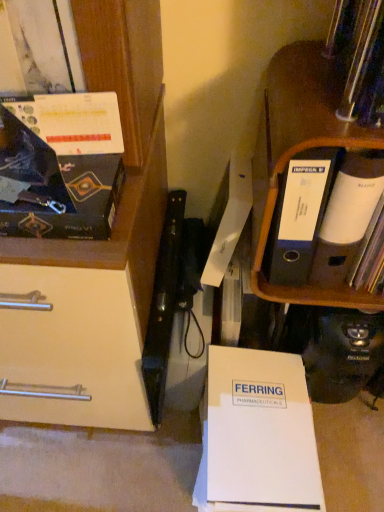
Locate an element on the screen. The image size is (384, 512). vacant region to the left of white paper at lower center is located at coordinates (142, 466).